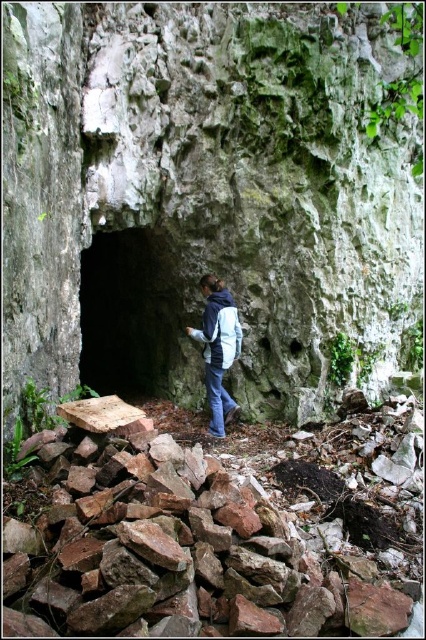
Question: Which object appears closest to the camera in this image?

Choices:
 (A) dark stone cave at center
 (B) blue fleece jacket at center
 (C) green mossy rock at center
 (D) rusty stone rubble at lower center

Answer: (D)

Question: Among these objects, which one is farthest from the camera?

Choices:
 (A) dark stone cave at center
 (B) blue denim jeans at center
 (C) green mossy rock at center
 (D) blue fleece jacket at center

Answer: (A)

Question: Is rusty stone rubble at lower center smaller than dark stone cave at center?

Choices:
 (A) no
 (B) yes

Answer: (B)

Question: Which point is farther from the camera taking this photo?

Choices:
 (A) (155, 340)
 (B) (135, 289)
 (C) (221, 298)
 (D) (60, 596)

Answer: (B)

Question: Is green mossy rock at center to the left of dark stone cave at center from the viewer's perspective?

Choices:
 (A) yes
 (B) no

Answer: (B)

Question: Does green mossy rock at center have a greater width compared to blue fleece jacket at center?

Choices:
 (A) yes
 (B) no

Answer: (A)